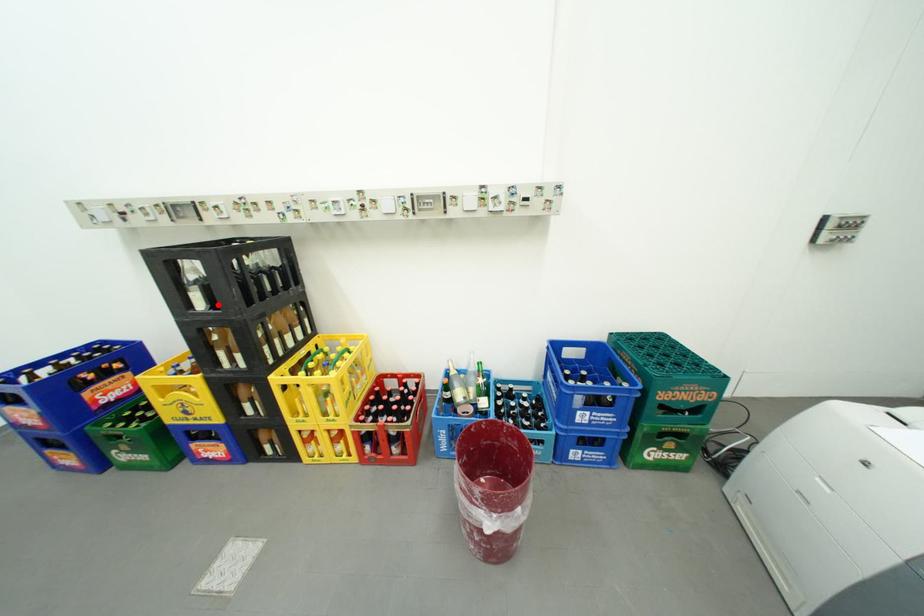
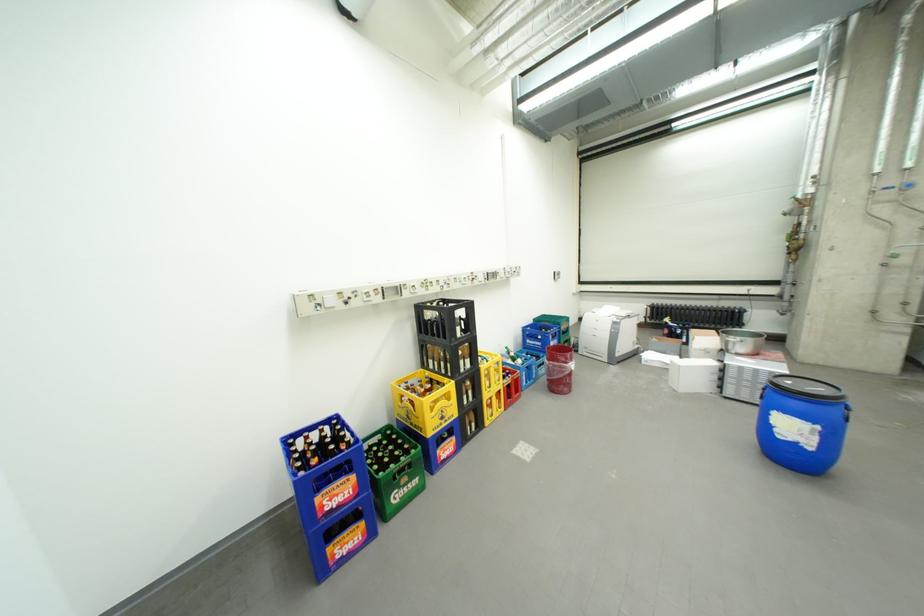
The point at the highlighted location is marked in the first image. Where is the corresponding point in the second image?

(470, 333)